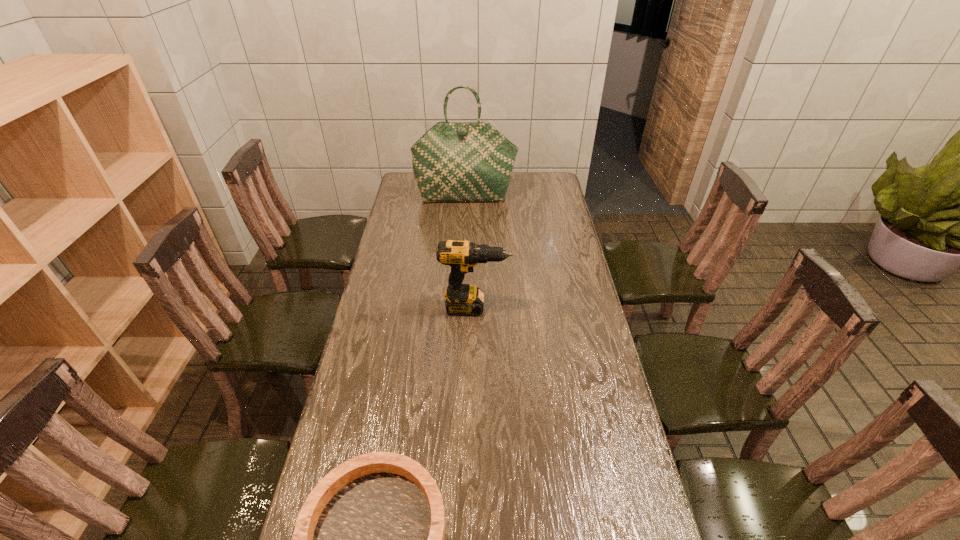
I want to click on vacant area at the far right corner of the desktop, so click(x=527, y=177).

The width and height of the screenshot is (960, 540). I want to click on object identified as the closest to the tote bag, so click(x=462, y=299).

At what (x,y) coordinates should I click in order to perform the action: click on object that ranks as the second closest to the farthest object. Please return your answer as a coordinate pair (x, y). Looking at the image, I should click on (369, 539).